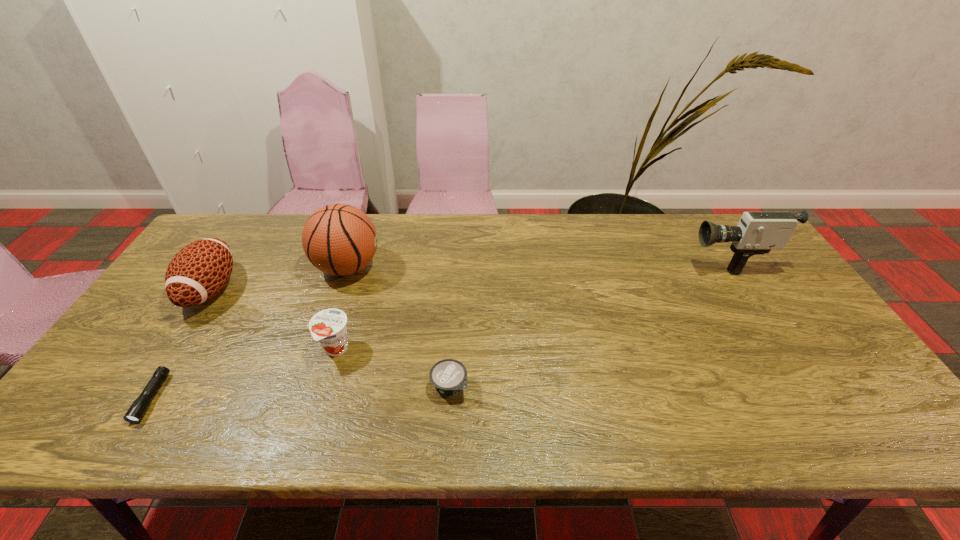
The width and height of the screenshot is (960, 540). I want to click on blank space that satisfies the following two spatial constraints: 1. on the side where the inflation valve is located; 2. on the right side of the basketball, so [320, 349].

The height and width of the screenshot is (540, 960). Find the location of `vacant area that satisfies the following two spatial constraints: 1. on the side where the inflation valve is located; 2. on the left side of the basketball`. vacant area that satisfies the following two spatial constraints: 1. on the side where the inflation valve is located; 2. on the left side of the basketball is located at coordinates (320, 349).

Locate an element on the screen. vacant region that satisfies the following two spatial constraints: 1. on the side where the inflation valve is located; 2. on the right side of the fourth tallest object is located at coordinates (x=320, y=349).